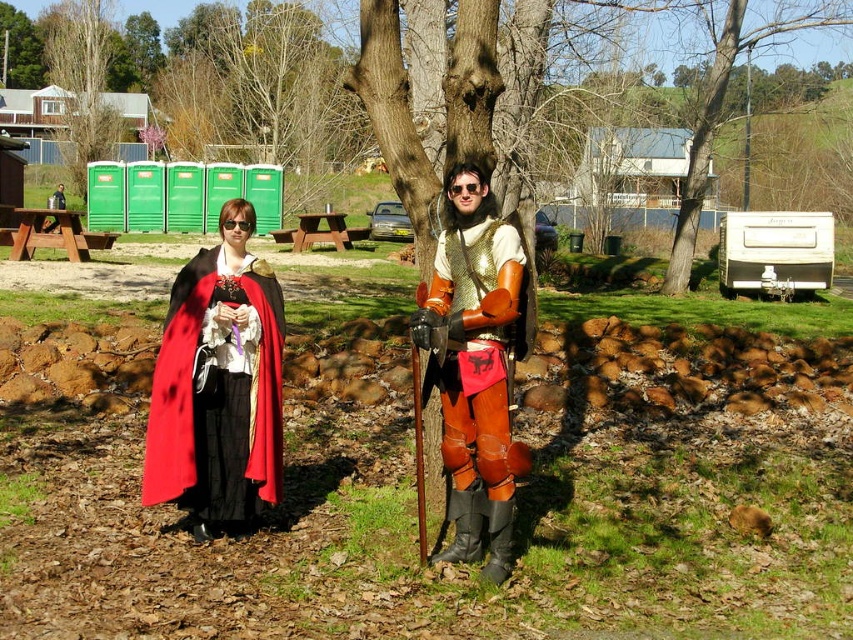
Question: Which point appears farthest from the camera in this image?

Choices:
 (A) (473, 216)
 (B) (154, 401)
 (C) (41, 16)
 (D) (473, 470)

Answer: (C)

Question: Is leather armor at center above smooth white trailer at right?

Choices:
 (A) yes
 (B) no

Answer: (B)

Question: Which point is farther to the camera?

Choices:
 (A) (527, 449)
 (B) (802, 24)
 (C) (489, 269)
 (D) (67, 132)

Answer: (D)

Question: Can you confirm if velvet red cape at center is positioned above leather armor at center?

Choices:
 (A) yes
 (B) no

Answer: (B)

Question: Does velvet red cape at center lie behind matte black cape at center?

Choices:
 (A) yes
 (B) no

Answer: (B)

Question: Which object is closer to the camera taking this photo?

Choices:
 (A) smooth white trailer at right
 (B) leather armor at center
 (C) matte black cape at center
 (D) green leafy tree at upper left

Answer: (B)